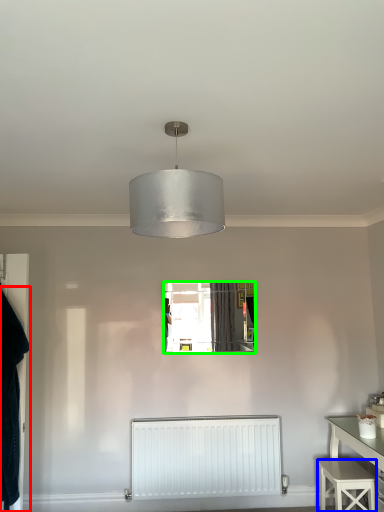
Question: Which object is positioned farthest from clothing (highlighted by a red box)? Select from stool (highlighted by a blue box) and mirror (highlighted by a green box).

Choices:
 (A) stool
 (B) mirror

Answer: (A)